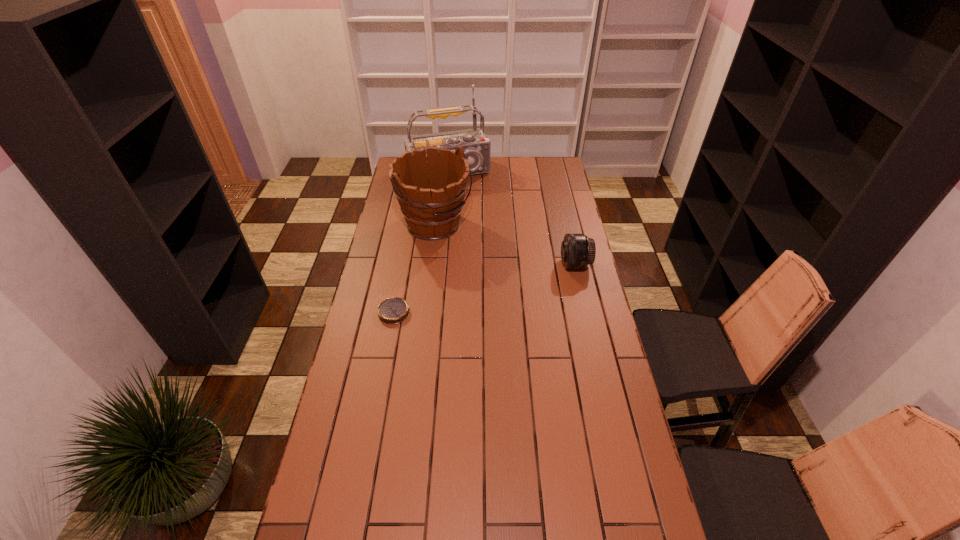
Identify the location of vacant area in the image that satisfies the following two spatial constraints: 1. on the back side of the third shortest object; 2. on the left side of the shortest object. This screenshot has height=540, width=960. (410, 225).

Where is `vacant space that satisfies the following two spatial constraints: 1. on the back side of the compass; 2. on the left side of the radio receiver`? vacant space that satisfies the following two spatial constraints: 1. on the back side of the compass; 2. on the left side of the radio receiver is located at coordinates (420, 172).